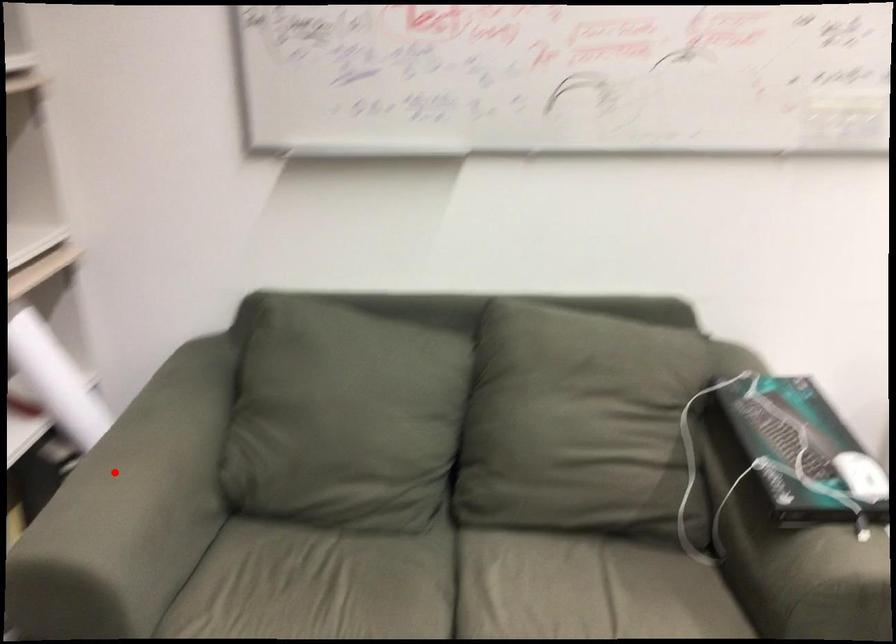
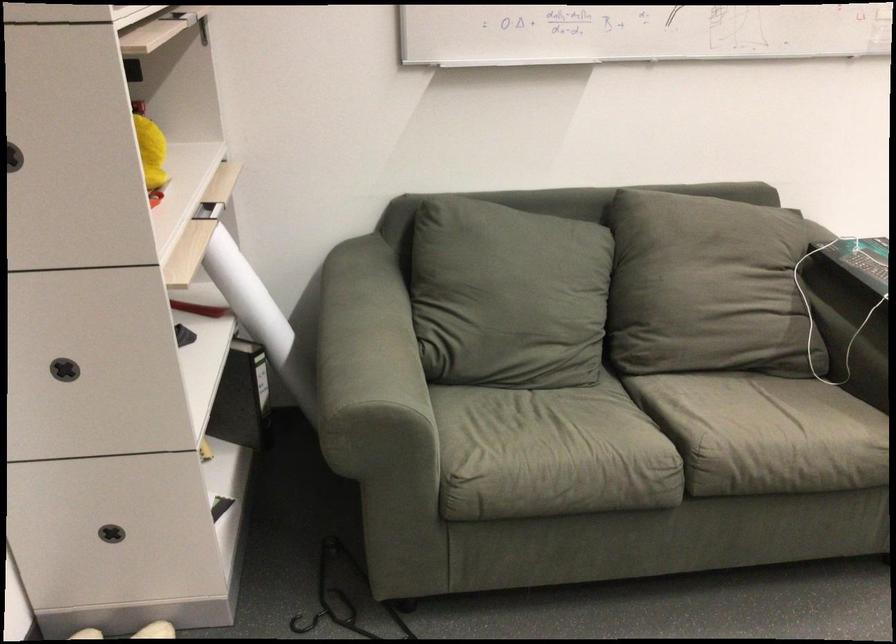
Question: I am providing you with two images of the same scene from different viewpoints. In image1, a red point is highlighted. Considering the same 3D point in image2, which of the following is correct?

Choices:
 (A) It is closer
 (B) It is farther

Answer: (B)